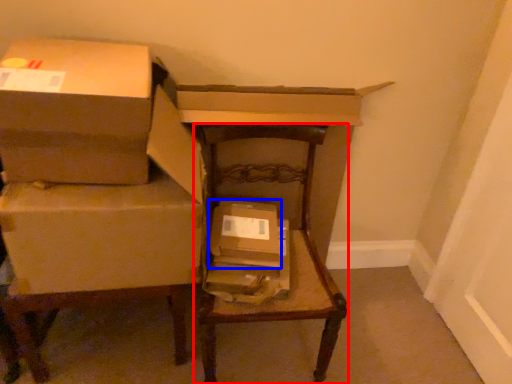
Question: Which object is further to the camera taking this photo, furniture (highlighted by a red box) or box (highlighted by a blue box)?

Choices:
 (A) furniture
 (B) box

Answer: (B)